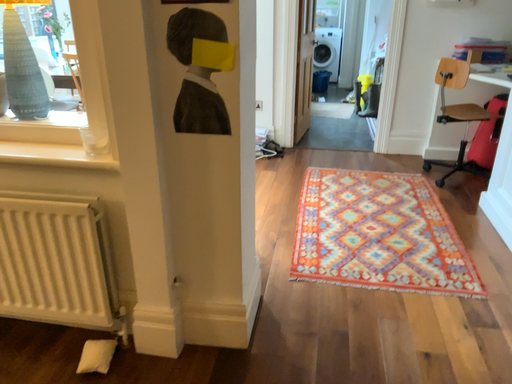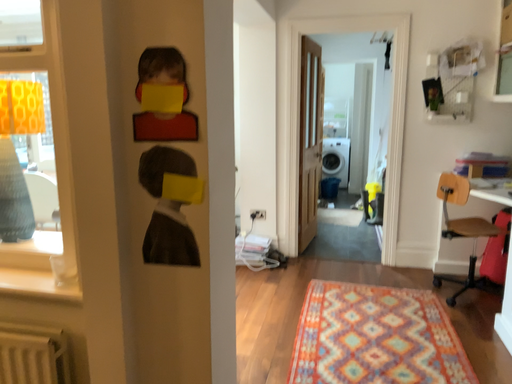
Question: How did the camera likely rotate when shooting the video?

Choices:
 (A) rotated upward
 (B) rotated downward

Answer: (A)